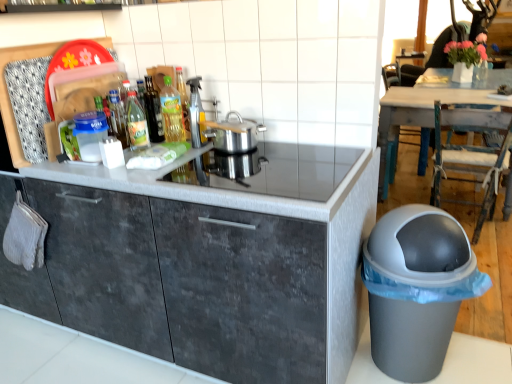
Image resolution: width=512 pixels, height=384 pixels. What do you see at coordinates (401, 74) in the screenshot?
I see `wooden chair at upper right, which ranks as the first chair in back-to-front order` at bounding box center [401, 74].

You are a GUI agent. You are given a task and a screenshot of the screen. Output one action in this format:
    pyautogui.click(x=<x>, y=<y>)
    Task: Click on the wooden chair at upper right, which ranks as the first chair in back-to-front order
    The height and width of the screenshot is (384, 512).
    Given the screenshot: What is the action you would take?
    click(401, 74)

What do you see at coordinates (172, 113) in the screenshot? I see `green glass bottle at center, placed as the 1th bottle when sorted from right to left` at bounding box center [172, 113].

Image resolution: width=512 pixels, height=384 pixels. I want to click on translucent plastic spray bottle at center, so [196, 113].

How many degrees apart are the facing directions of wooden chair at upper right, which ranks as the first chair in back-to-front order, and stainless steel pot at center?

The facing directions of wooden chair at upper right, which ranks as the first chair in back-to-front order, and stainless steel pot at center are 90.5 degrees apart.

From a real-world perspective, is wooden chair at upper right, positioned as the second chair in front-to-back order, on stainless steel pot at center?

Actually, wooden chair at upper right, positioned as the second chair in front-to-back order, is physically below stainless steel pot at center in the real world.

Is wooden chair at upper right, which ranks as the first chair in back-to-front order, in contact with stainless steel pot at center?

No, wooden chair at upper right, which ranks as the first chair in back-to-front order, is not next to stainless steel pot at center.

Who is shorter, translucent glass bottle at center, which is counted as the third bottle, starting from the right, or wooden rustic table at upper right?

translucent glass bottle at center, which is counted as the third bottle, starting from the right.

Is translucent glass bottle at center, which is counted as the third bottle, starting from the right, positioned with its back to wooden rustic table at upper right?

No, translucent glass bottle at center, which is counted as the third bottle, starting from the right, is not facing the opposite direction of wooden rustic table at upper right.

Where is `the 2nd bottle below the wooden rustic table at upper right (from the image's perspective)`? The height and width of the screenshot is (384, 512). the 2nd bottle below the wooden rustic table at upper right (from the image's perspective) is located at coordinates (117, 117).

Which of these two, translucent plastic spray bottle at center or translucent glass bottle at center, which is counted as the third bottle, starting from the right, stands taller?

Standing taller between the two is translucent plastic spray bottle at center.

Does translucent plastic spray bottle at center have a lesser width compared to translucent glass bottle at center, which is counted as the third bottle, starting from the right?

Incorrect, the width of translucent plastic spray bottle at center is not less than that of translucent glass bottle at center, which is counted as the third bottle, starting from the right.

Is the position of translucent plastic spray bottle at center less distant than that of translucent glass bottle at center, which is counted as the third bottle, starting from the right?

Yes, it is.

Which point is more distant from viewer, (199, 126) or (123, 117)?

The point (123, 117) is more distant.

Which is in front, point (395, 107) or point (194, 116)?

The point (194, 116) is closer to the camera.

Which object is more forward, wooden rustic table at upper right or translucent plastic spray bottle at center?

Positioned in front is translucent plastic spray bottle at center.

Which of these two, wooden rustic table at upper right or translucent plastic spray bottle at center, stands shorter?

Standing shorter between the two is translucent plastic spray bottle at center.

The image size is (512, 384). I want to click on table on the right side of translucent plastic spray bottle at center, so click(x=426, y=109).

Is stainless steel pot at center facing away from wooden chair at upper right, which ranks as the first chair in back-to-front order?

That's right, stainless steel pot at center is facing away from wooden chair at upper right, which ranks as the first chair in back-to-front order.

Does stainless steel pot at center touch wooden chair at upper right, positioned as the second chair in front-to-back order?

They are not placed beside each other.

Is translucent plastic spray bottle at center far from gray plastic waste bin at lower right?

translucent plastic spray bottle at center is near gray plastic waste bin at lower right, not far away.

Based on their sizes in the image, would you say translucent plastic spray bottle at center is bigger or smaller than gray plastic waste bin at lower right?

In the image, translucent plastic spray bottle at center appears to be smaller than gray plastic waste bin at lower right.

Is translucent plastic spray bottle at center behind gray plastic waste bin at lower right?

Yes.

From a real-world perspective, does translucent plastic spray bottle at center sit lower than gray plastic waste bin at lower right?

Actually, translucent plastic spray bottle at center is physically above gray plastic waste bin at lower right in the real world.

Is point (417, 112) in front of point (128, 115)?

No, it is behind (128, 115).

Is wooden rustic table at upper right positioned in front of translucent glass bottle at center, the 2th bottle from the left?

No.

From a real-world perspective, is wooden rustic table at upper right above or below translucent glass bottle at center, the 2th bottle from the left?

wooden rustic table at upper right is situated lower than translucent glass bottle at center, the 2th bottle from the left, in the real world.

From the picture: Who is taller, wooden rustic table at upper right or translucent glass bottle at center, the 2th bottle from the left?

With more height is wooden rustic table at upper right.

The height and width of the screenshot is (384, 512). I want to click on home appliance in front of the wooden chair at upper right, which ranks as the first chair in back-to-front order, so click(x=271, y=170).

From the image's perspective, which bottle is the 2nd one below the wooden rustic table at upper right? Please provide its 2D coordinates.

[(117, 117)]

Estimate the real-world distances between objects in this image. Which object is closer to rustic wood chair at right, the 2th chair in the back-to-front sequence, wooden rustic table at upper right or translucent glass bottle at center, the 2th bottle from the left?

wooden rustic table at upper right.

Based on their spatial positions, is stainless steel pot at center or translucent glass bottle at center, placed as the 1th bottle when sorted from left to right, closer to silver metallic pot at center?

stainless steel pot at center is positioned closer to the anchor silver metallic pot at center.

Considering their positions, is wooden rustic table at upper right positioned further to wooden chair at upper right, positioned as the second chair in front-to-back order, than green glass bottle at center, placed as the 3th bottle when sorted from left to right?

The object further to wooden chair at upper right, positioned as the second chair in front-to-back order, is green glass bottle at center, placed as the 3th bottle when sorted from left to right.

Looking at the image, which one is located further to rustic wood chair at right, which ranks as the first chair in front-to-back order, wooden rustic table at upper right or gray plastic waste bin at lower right?

gray plastic waste bin at lower right is further to rustic wood chair at right, which ranks as the first chair in front-to-back order.

From the image, which object appears to be farther from wooden rustic table at upper right, dark gray concrete cabinet at center or translucent glass bottle at center, which is counted as the third bottle, starting from the right?

translucent glass bottle at center, which is counted as the third bottle, starting from the right, is positioned further to the anchor wooden rustic table at upper right.

Which object lies further to the anchor point rustic wood chair at right, the 2th chair in the back-to-front sequence, translucent glass bottle at center, placed as the 1th bottle when sorted from left to right, or silver metallic pot at center?

Among the two, translucent glass bottle at center, placed as the 1th bottle when sorted from left to right, is located further to rustic wood chair at right, the 2th chair in the back-to-front sequence.

When comparing their distances from dark gray concrete cabinet at center, does wooden rustic table at upper right or wooden chair at upper right, which ranks as the first chair in back-to-front order, seem further?

Among the two, wooden chair at upper right, which ranks as the first chair in back-to-front order, is located further to dark gray concrete cabinet at center.

Which object lies further to the anchor point green glass bottle at center, placed as the 3th bottle when sorted from left to right, translucent plastic spray bottle at center or wooden rustic table at upper right?

wooden rustic table at upper right is further to green glass bottle at center, placed as the 3th bottle when sorted from left to right.

Image resolution: width=512 pixels, height=384 pixels. Find the location of `cabinetry located between green glass bottle at center, placed as the 3th bottle when sorted from left to right, and rustic wood chair at right, which ranks as the first chair in front-to-back order, in the left-right direction`. cabinetry located between green glass bottle at center, placed as the 3th bottle when sorted from left to right, and rustic wood chair at right, which ranks as the first chair in front-to-back order, in the left-right direction is located at coordinates (206, 261).

What are the coordinates of `bottle between translucent glass bottle at center, the 2th bottle from the left, and translucent plastic spray bottle at center from left to right` in the screenshot? It's located at (172, 113).

Find the location of a particular element. Image resolution: width=512 pixels, height=384 pixels. appliance between translucent glass bottle at center, positioned as the second bottle in right-to-left order, and gray plastic waste bin at lower right, in the horizontal direction is located at coordinates (196, 113).

Locate an element on the screen. Image resolution: width=512 pixels, height=384 pixels. appliance situated between translucent glass bottle at center, which is counted as the third bottle, starting from the right, and gray plastic waste bin at lower right from left to right is located at coordinates (196, 113).